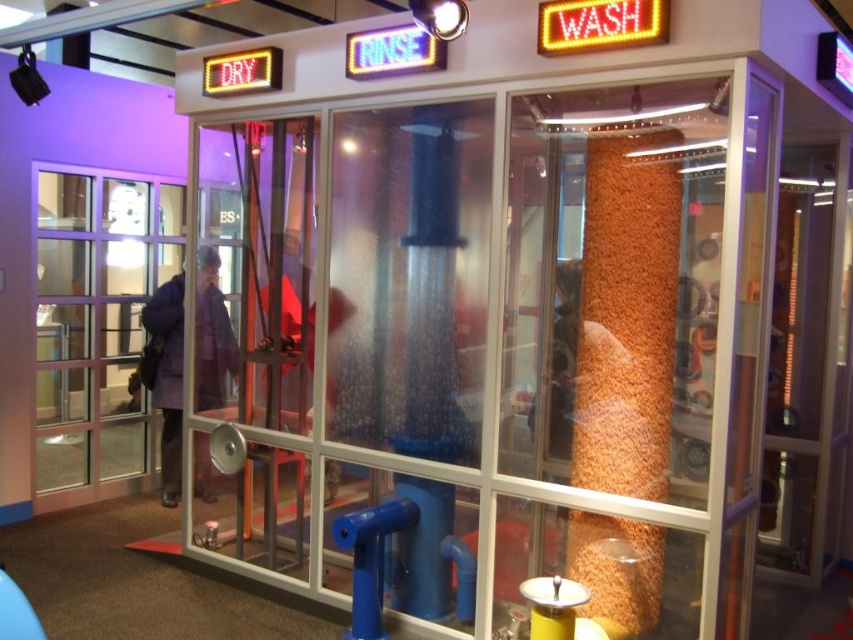
Question: Estimate the real-world distances between objects in this image. Which object is closer to the clear glass door at left?

Choices:
 (A) matte red shirt at center
 (B) purple fabric coat at center

Answer: (B)

Question: Does clear glass door at left appear under matte red shirt at center?

Choices:
 (A) no
 (B) yes

Answer: (B)

Question: Which of the following is the farthest from the observer?

Choices:
 (A) purple fabric coat at center
 (B) matte red shirt at center

Answer: (A)

Question: Is clear glass door at left behind matte red shirt at center?

Choices:
 (A) yes
 (B) no

Answer: (A)

Question: Is purple fabric coat at center further to the viewer compared to matte red shirt at center?

Choices:
 (A) no
 (B) yes

Answer: (B)

Question: Estimate the real-world distances between objects in this image. Which object is closer to the clear glass door at left?

Choices:
 (A) purple fabric coat at center
 (B) matte red shirt at center

Answer: (A)